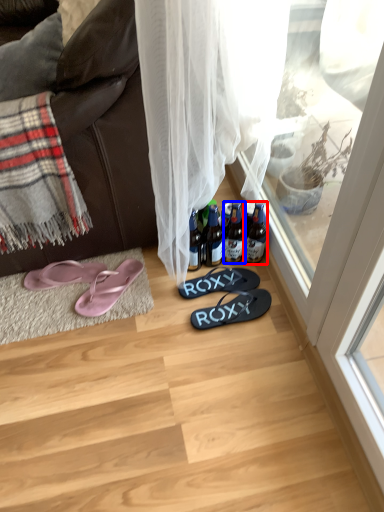
Question: Which object is closer to the camera taking this photo, bottle (highlighted by a red box) or bottle (highlighted by a blue box)?

Choices:
 (A) bottle
 (B) bottle

Answer: (B)